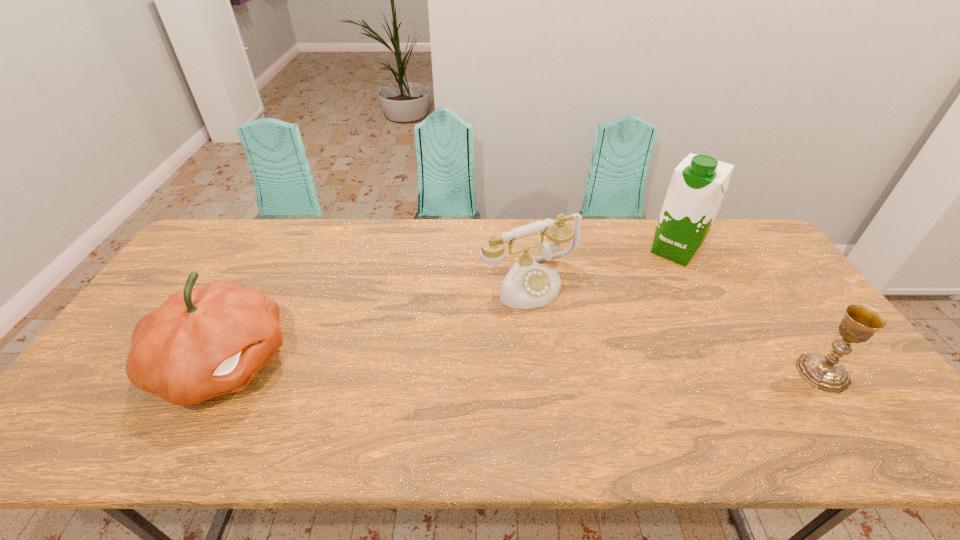
At what (x,y) coordinates should I click in order to perform the action: click on vacant point that satisfies the following two spatial constraints: 1. on the front side of the rightmost object; 2. on the right side of the second object from left to right. Please return your answer as a coordinate pair (x, y). Image resolution: width=960 pixels, height=540 pixels. Looking at the image, I should click on (540, 373).

I want to click on free space that satisfies the following two spatial constraints: 1. on the front side of the soya milk; 2. on the left side of the rightmost object, so click(738, 373).